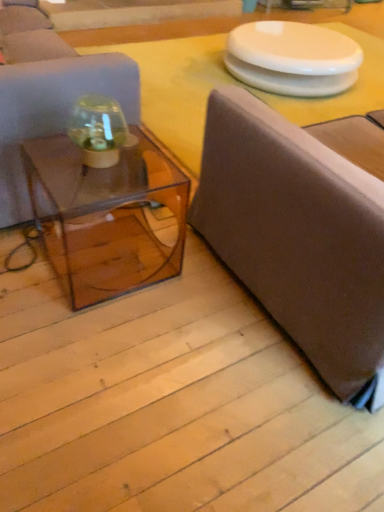
Question: From their relative heights in the image, would you say transparent glass jar at center is taller or shorter than white glossy round table at upper center?

Choices:
 (A) tall
 (B) short

Answer: (B)

Question: Is transparent glass jar at center in front of or behind white glossy round table at upper center in the image?

Choices:
 (A) behind
 (B) front

Answer: (B)

Question: Based on their relative distances, which object is nearer to the transparent glass table at center?

Choices:
 (A) transparent acrylic coffee table at center
 (B) matte brown couch at left, the 2th studio couch viewed from the right
 (C) transparent glass jar at center
 (D) white glossy round table at upper center
 (E) matte gray studio couch at right, which appears as the 2th studio couch when viewed from the left

Answer: (D)

Question: Which object is the farthest from the transparent glass table at center?

Choices:
 (A) white glossy round table at upper center
 (B) matte brown couch at left, marked as the 1th studio couch in a left-to-right arrangement
 (C) transparent glass jar at center
 (D) matte gray studio couch at right, the 1th studio couch positioned from the right
 (E) transparent acrylic coffee table at center

Answer: (B)